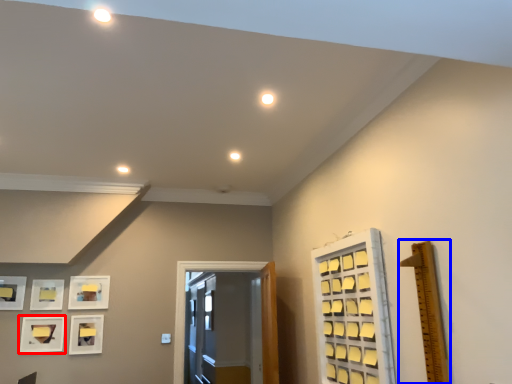
Question: Which of the following is the farthest to the observer, picture frame (highlighted by a red box) or ruler (highlighted by a blue box)?

Choices:
 (A) picture frame
 (B) ruler

Answer: (A)